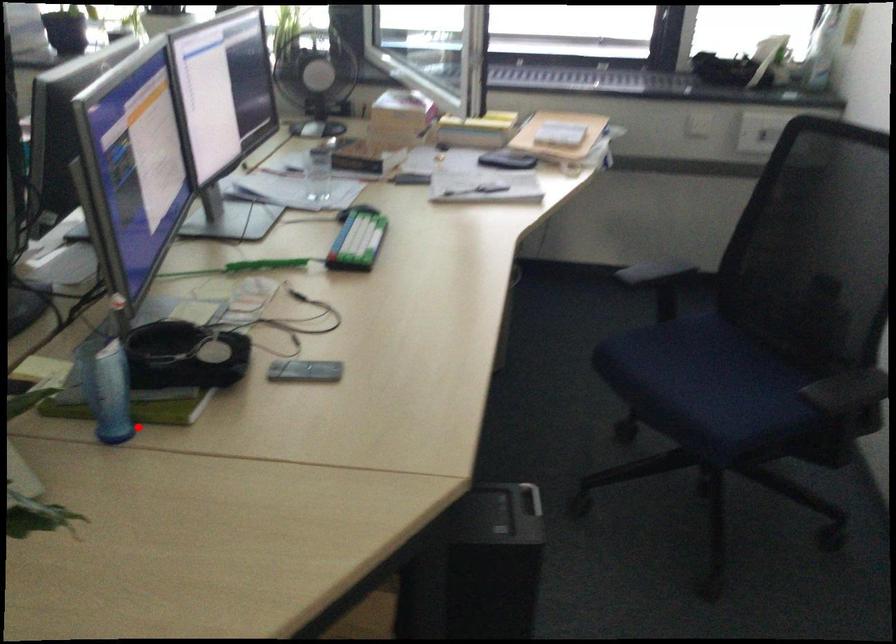
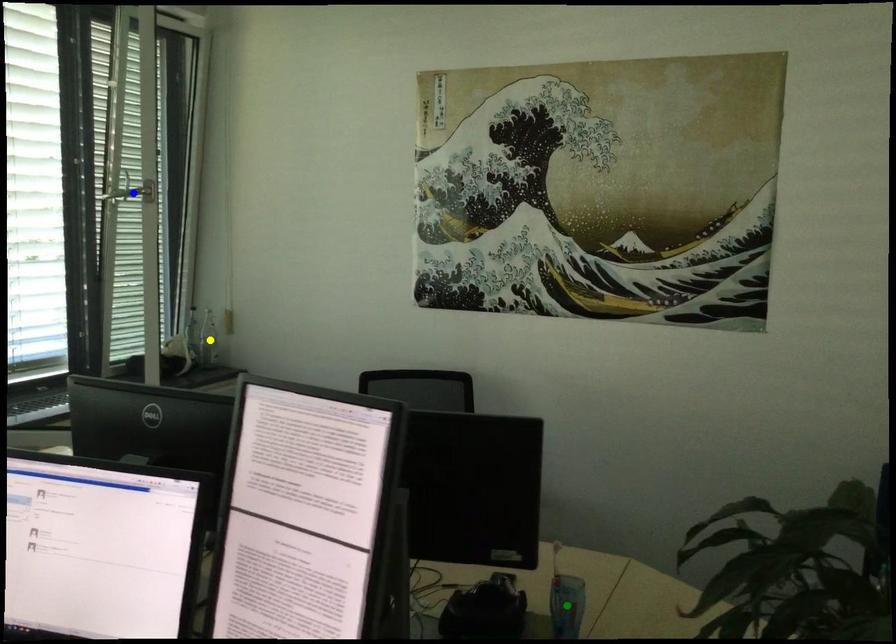
Question: I am providing you with two images of the same scene from different viewpoints. A red point is marked on the first image. You are given multiple points on the second image. Which mark in image 2 goes with the point in image 1?

Choices:
 (A) yellow point
 (B) blue point
 (C) green point

Answer: (C)